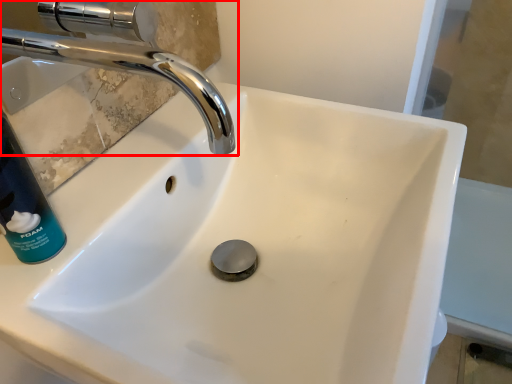
Question: From the image's perspective, where is tap (annotated by the red box) located relative to cleaning product?

Choices:
 (A) below
 (B) above

Answer: (B)